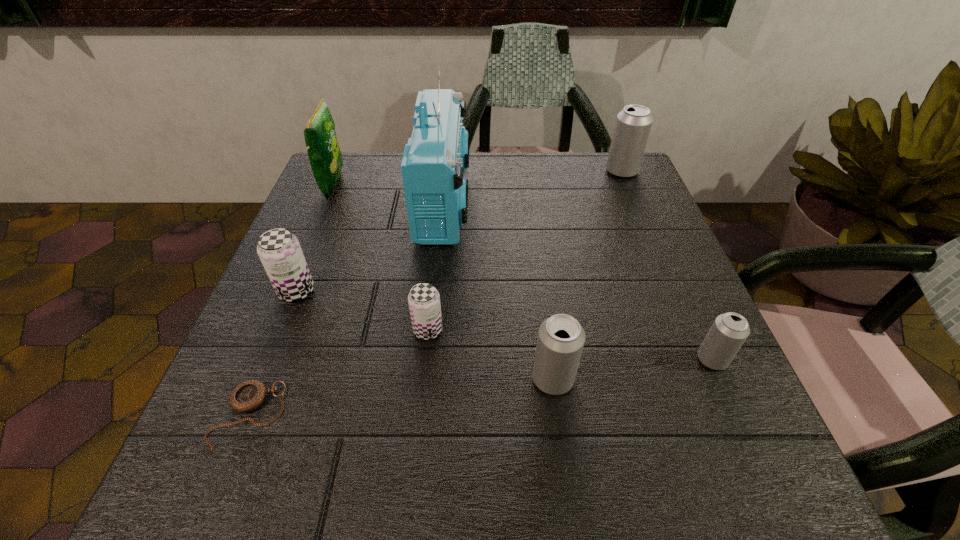
The image size is (960, 540). Find the location of `unoccupied area between the shortest object and the blue radio receiver`. unoccupied area between the shortest object and the blue radio receiver is located at coordinates (347, 308).

This screenshot has height=540, width=960. Identify the location of unoccupied position between the fourth beer can from right to left and the bigger purple beer can. (362, 310).

The image size is (960, 540). What are the coordinates of `empty space between the shortest object and the radio receiver` in the screenshot? It's located at (347, 308).

This screenshot has width=960, height=540. Find the location of `vacant space in between the fifth farthest object and the shortest object`. vacant space in between the fifth farthest object and the shortest object is located at coordinates (338, 373).

You are a GUI agent. You are given a task and a screenshot of the screen. Output one action in this format:
    pyautogui.click(x=<x>, y=<y>)
    Task: Click on the vacant area that lies between the pocket watch and the fifth farthest object
    This screenshot has height=540, width=960.
    Given the screenshot: What is the action you would take?
    pyautogui.click(x=338, y=373)

Where is `empty location between the radio receiver and the shortest object`? The width and height of the screenshot is (960, 540). empty location between the radio receiver and the shortest object is located at coordinates (347, 308).

Where is `object that stands as the sixth closest to the second farthest beer can`? This screenshot has width=960, height=540. object that stands as the sixth closest to the second farthest beer can is located at coordinates (729, 331).

Locate an element on the screen. The image size is (960, 540). object that is the closest one to the green crisp (potato chip) is located at coordinates (435, 157).

Choose which beer can is the fourth nearest neighbor to the crisp (potato chip). Please provide its 2D coordinates. Your answer should be formatted as a tuple, i.e. [(x, y)], where the tuple contains the x and y coordinates of a point satisfying the conditions above.

[(633, 124)]

Identify which beer can is the third closest to the farthest beer can. Please provide its 2D coordinates. Your answer should be formatted as a tuple, i.e. [(x, y)], where the tuple contains the x and y coordinates of a point satisfying the conditions above.

[(424, 300)]